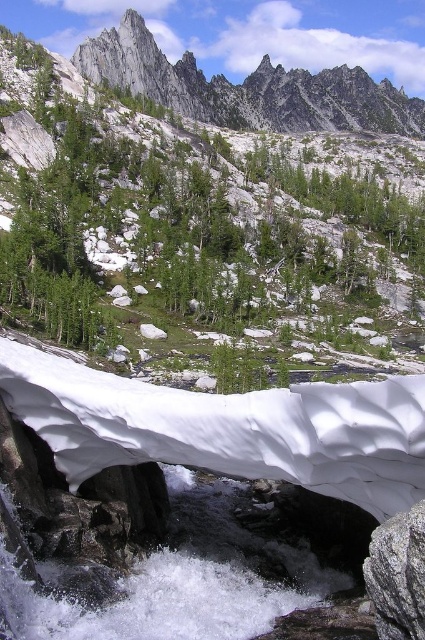
You are a hiker who wants to reach the rugged granite peaks at upper center. According to the map coordinates, what are the exact coordinates where you should head towards?

The rugged granite peaks at upper center are located at coordinates point (x=248, y=88).

You are a hiker planning to cross the river using the snow arch. The gray rough rock at lower right is your starting point. Which direction should you head to reach the rugged granite peaks at upper center?

To reach the rugged granite peaks at upper center from the gray rough rock at lower right, you should head upward since the rugged granite peaks at upper center are larger in size and located above the gray rough rock at lower right.